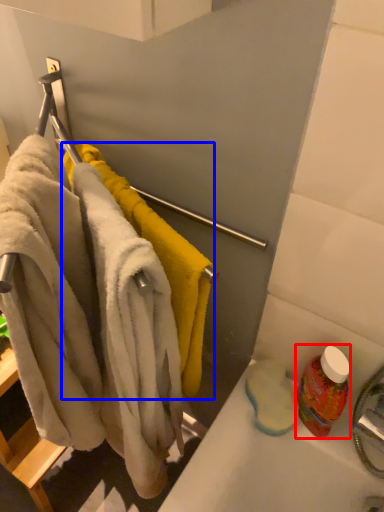
Question: Which point is closer to the camera, cleaning product (highlighted by a red box) or towel (highlighted by a blue box)?

Choices:
 (A) cleaning product
 (B) towel

Answer: (B)